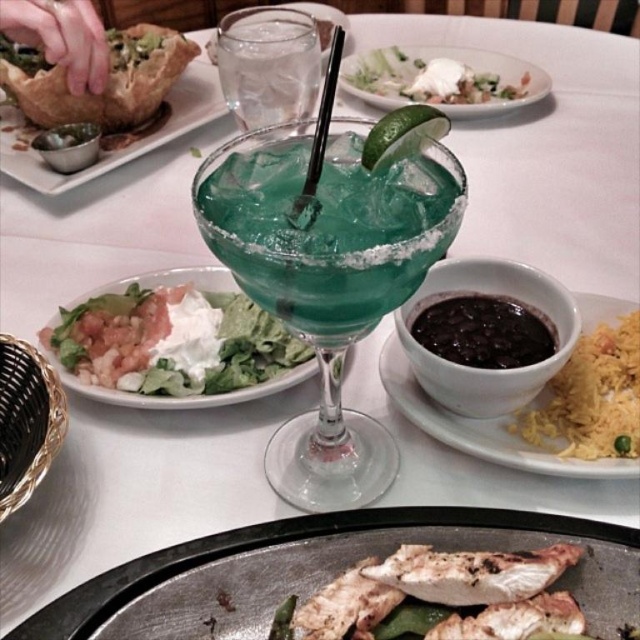
Is teal glass margarita at center wider than white grilled chicken at center?

Incorrect, teal glass margarita at center's width does not surpass white grilled chicken at center's.

Does teal glass margarita at center have a lesser width compared to white grilled chicken at center?

Correct, teal glass margarita at center's width is less than white grilled chicken at center's.

Locate an element on the screen. teal glass margarita at center is located at coordinates (330, 275).

Can you confirm if teal glass margarita at center is positioned below black matte bowl at right?

Actually, teal glass margarita at center is above black matte bowl at right.

Can you confirm if teal glass margarita at center is taller than black matte bowl at right?

Yes.

Who is more distant from viewer, (288, 154) or (512, 440)?

Point (512, 440)

Where is `teal glass margarita at center`? The height and width of the screenshot is (640, 640). teal glass margarita at center is located at coordinates (330, 275).

At what (x,y) coordinates should I click in order to perform the action: click on dark brown rice at right. Please return your answer as a coordinate pair (x, y). This screenshot has height=640, width=640. Looking at the image, I should click on (592, 397).

Identify the location of dark brown rice at right. (592, 397).